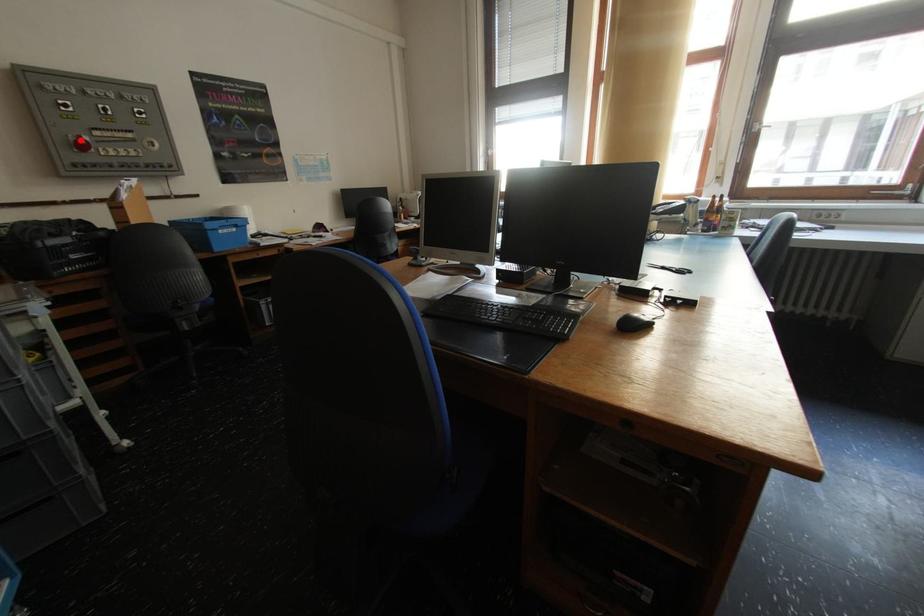
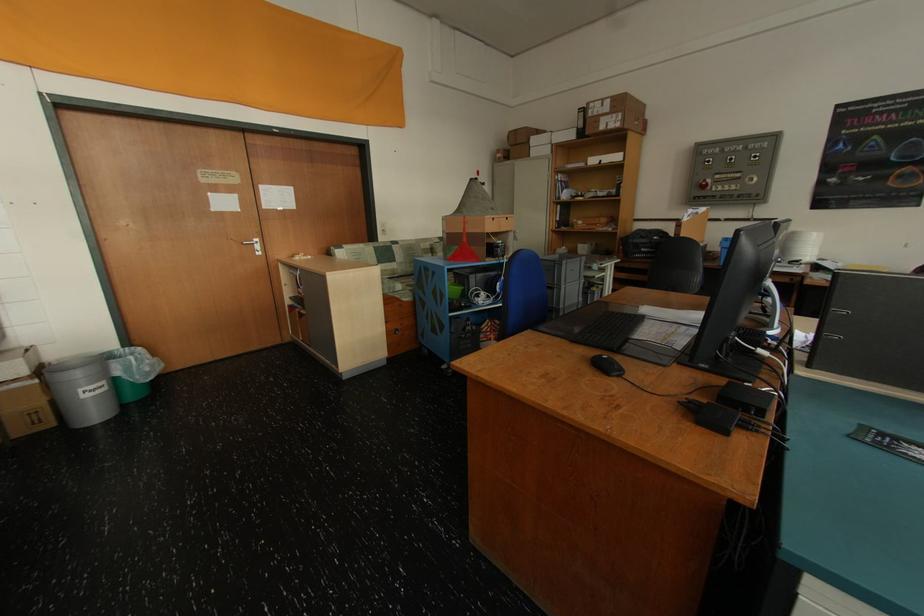
Question: I am providing you with two images of the same scene from different viewpoints. A red point is shown in image1. For the corresponding object point in image2, is it positioned nearer or farther from the camera?

Choices:
 (A) Nearer
 (B) Farther

Answer: (A)